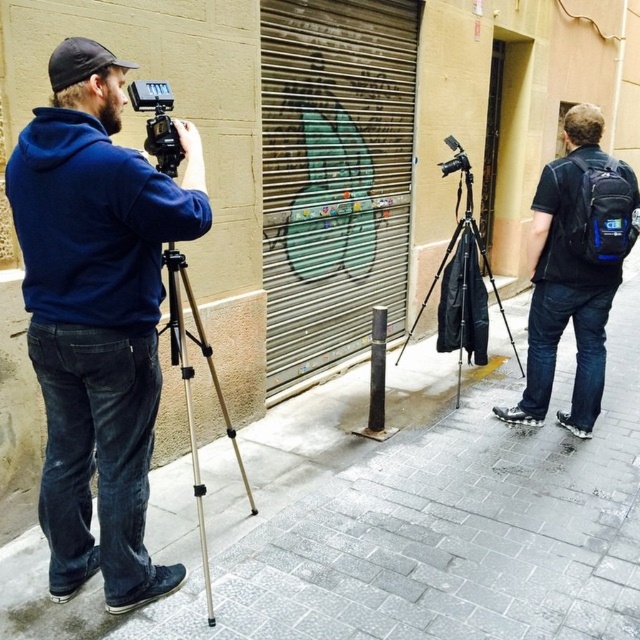
Which is more to the left, matte black camera at left or black matte pole at center?

From the viewer's perspective, matte black camera at left appears more on the left side.

This screenshot has height=640, width=640. In order to click on matte black camera at left in this screenshot , I will do `click(157, 124)`.

Can you confirm if matte blue hoodie at left is positioned above silver metallic tripod at left?

Indeed, matte blue hoodie at left is positioned over silver metallic tripod at left.

Which is behind, point (40, 497) or point (195, 324)?

The point (195, 324) is behind.

From the picture: Who is more distant from viewer, (124, 525) or (179, 330)?

Point (179, 330)

Find the location of a particular element. This screenshot has height=640, width=640. matte blue hoodie at left is located at coordinates (97, 316).

Between matte blue hoodie at left and blue fabric backpack at right, which one appears on the right side from the viewer's perspective?

Positioned to the right is blue fabric backpack at right.

Can you confirm if matte blue hoodie at left is positioned to the right of blue fabric backpack at right?

In fact, matte blue hoodie at left is to the left of blue fabric backpack at right.

The height and width of the screenshot is (640, 640). In order to click on matte blue hoodie at left in this screenshot , I will do `click(97, 316)`.